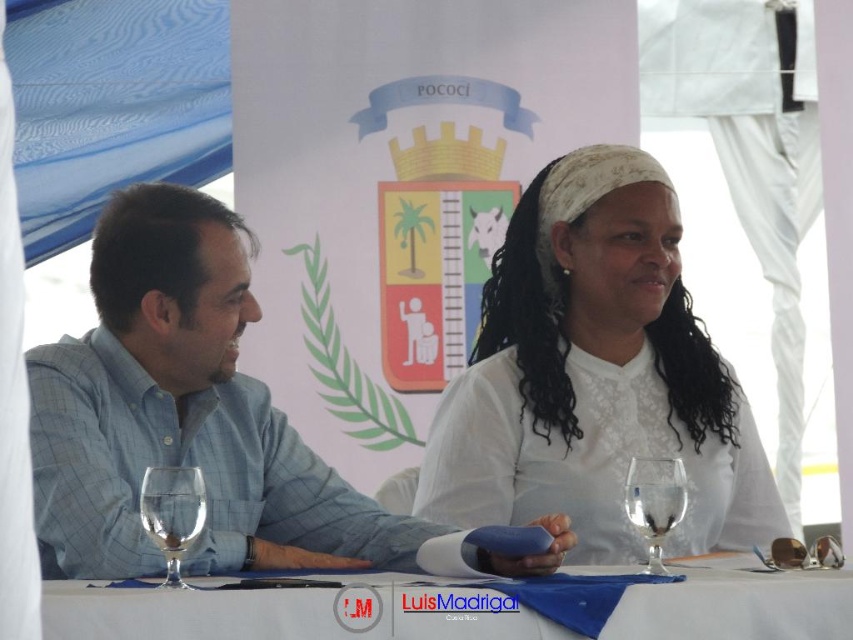
Which of these two, blue plaid shirt at left or transparent glass wine glass at lower center, stands shorter?

transparent glass wine glass at lower center

Based on the photo, which of these two, blue plaid shirt at left or transparent glass wine glass at lower center, stands taller?

blue plaid shirt at left

Who is more distant from viewer, (59, 525) or (149, 484)?

Positioned behind is point (59, 525).

This screenshot has width=853, height=640. Find the location of `blue plaid shirt at left`. blue plaid shirt at left is located at coordinates (183, 413).

Does transparent glass wine glass at lower center have a lesser width compared to transparent glass at center?

Yes.

Is transparent glass wine glass at lower center above transparent glass at center?

Indeed, transparent glass wine glass at lower center is positioned over transparent glass at center.

This screenshot has height=640, width=853. In order to click on transparent glass wine glass at lower center in this screenshot , I will do `click(172, 513)`.

I want to click on transparent glass wine glass at lower center, so click(172, 513).

Which is above, white lace blouse at center or blue plaid shirt at left?

white lace blouse at center is higher up.

Between point (434, 493) and point (134, 522), which one is positioned behind?

The point (434, 493) is behind.

This screenshot has width=853, height=640. I want to click on white lace blouse at center, so click(595, 376).